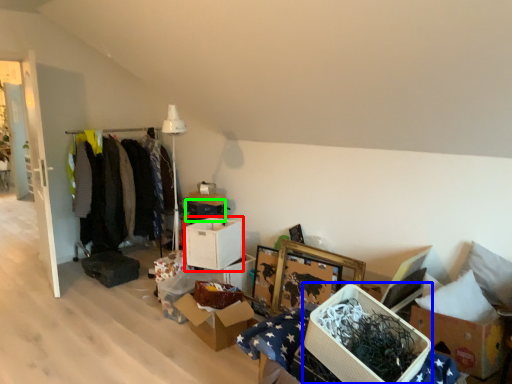
Question: Considering the real-world distances, which object is farthest from storage box (highlighted by a red box)? storage box (highlighted by a blue box) or storage box (highlighted by a green box)?

Choices:
 (A) storage box
 (B) storage box

Answer: (A)